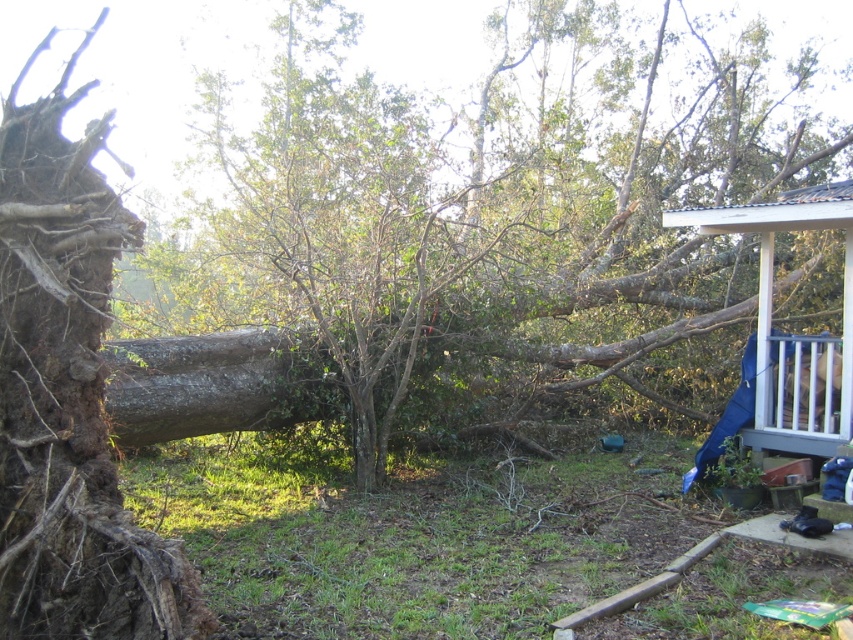
You are a construction worker assessing damage after a storm. You see the green rough bark tree at center and the white wooden porch at upper right. Which object is closer to the left side of the yard?

The green rough bark tree at center is closer to the left side of the yard because it is positioned to the left of the white wooden porch at upper right.

You are a contractor assessing damage after a storm. You notice the brown rough bark at left and the white wooden porch at upper right. Which object has a smaller width?

The brown rough bark at left is thinner than the white wooden porch at upper right, so the brown rough bark at left has a smaller width.

Looking at this image, you are a botanist examining the fallen tree in the yard. You notice a point marked at coordinates [68,396]. Based on the scene, what feature of the tree does this point most likely indicate?

The point at coordinates [68,396] corresponds to the brown rough bark at left, indicating the location of the exposed roots or damaged area of the tree trunk.